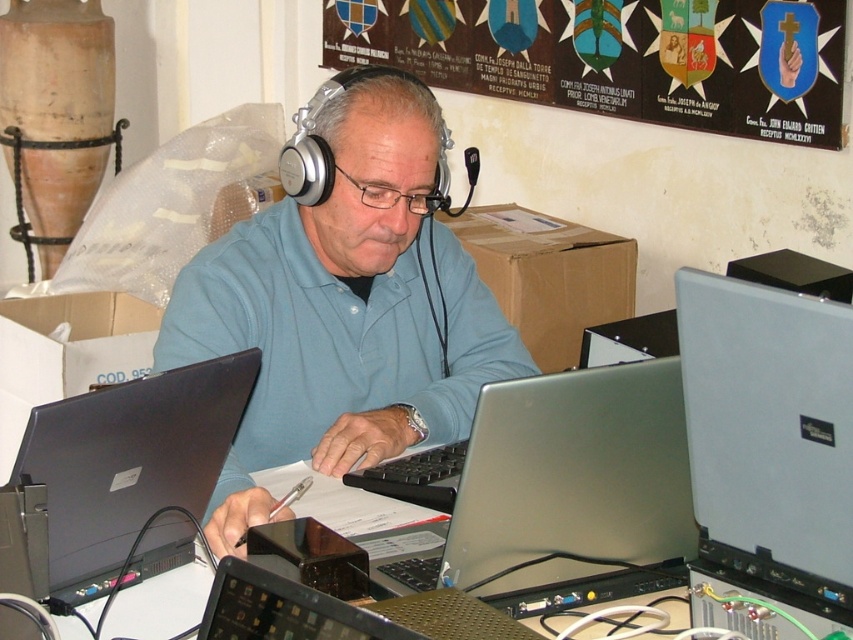
Question: Which object appears farthest from the camera in this image?

Choices:
 (A) metallic emblem at upper center
 (B) silver metallic laptop at center

Answer: (A)

Question: Does matte blue shirt at center appear over matte black laptop at left?

Choices:
 (A) no
 (B) yes

Answer: (B)

Question: Is slate gray plastic case at right positioned at the back of black glossy laptop at center?

Choices:
 (A) yes
 (B) no

Answer: (A)

Question: Which point is closer to the camera?

Choices:
 (A) (78, 554)
 (B) (550, 515)

Answer: (B)

Question: Considering the real-world distances, which object is closest to the black glossy laptop at center?

Choices:
 (A) silver metallic laptop at center
 (B) metallic emblem at upper center
 (C) matte black laptop at left

Answer: (A)

Question: Does slate gray plastic case at right have a larger size compared to metallic emblem at upper center?

Choices:
 (A) yes
 (B) no

Answer: (B)